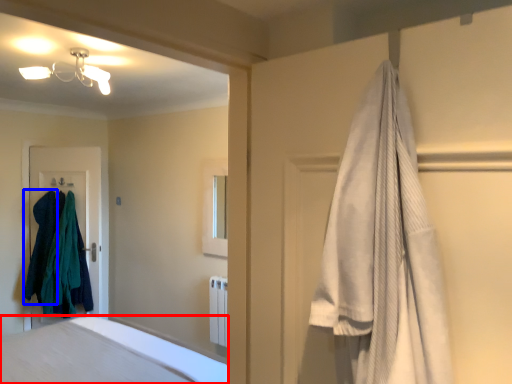
Question: Which point is further to the camera, bathtub (highlighted by a red box) or clothing (highlighted by a blue box)?

Choices:
 (A) bathtub
 (B) clothing

Answer: (B)